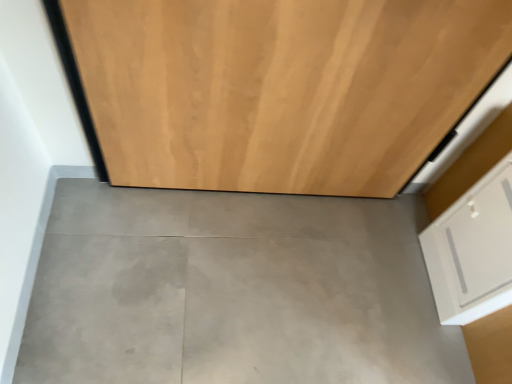
Find the location of a particular element. This screenshot has width=512, height=384. free spot in front of white matte drawer at lower right is located at coordinates (423, 317).